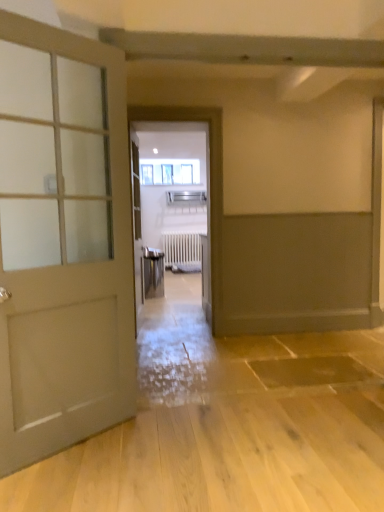
Question: Does point (4, 352) appear closer or farther from the camera than point (215, 271)?

Choices:
 (A) farther
 (B) closer

Answer: (B)

Question: In the image, is matte white door at left positioned in front of or behind metallic elevator at center?

Choices:
 (A) behind
 (B) front

Answer: (B)

Question: Which is nearer to the matte white door at left?

Choices:
 (A) clear glass window at center
 (B) metallic elevator at center
 (C) white matte radiator at center

Answer: (B)

Question: Considering the real-world distances, which object is closest to the clear glass window at center?

Choices:
 (A) white matte radiator at center
 (B) metallic elevator at center
 (C) matte white door at left

Answer: (A)